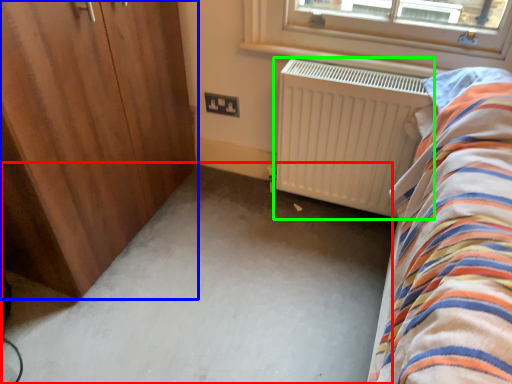
Question: Which object is the farthest from plain (highlighted by a red box)? Choose among these: door (highlighted by a blue box) or radiator (highlighted by a green box).

Choices:
 (A) door
 (B) radiator

Answer: (A)